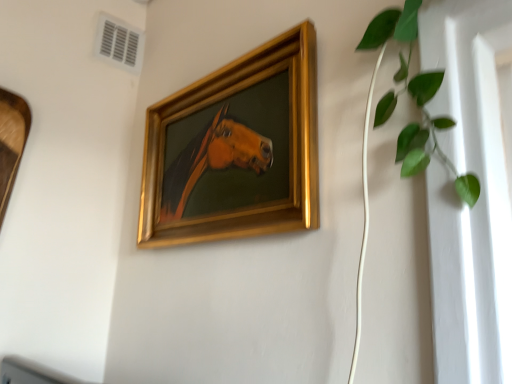
Question: Is white plastic air conditioning at upper left taller than gold/gilded picture frame at center?

Choices:
 (A) yes
 (B) no

Answer: (B)

Question: From the image's perspective, is white plastic air conditioning at upper left over gold/gilded picture frame at center?

Choices:
 (A) yes
 (B) no

Answer: (A)

Question: Considering the relative sizes of white plastic air conditioning at upper left and gold/gilded picture frame at center in the image provided, is white plastic air conditioning at upper left wider than gold/gilded picture frame at center?

Choices:
 (A) yes
 (B) no

Answer: (B)

Question: Is white plastic air conditioning at upper left positioned far away from gold/gilded picture frame at center?

Choices:
 (A) no
 (B) yes

Answer: (A)

Question: From the image's perspective, is white plastic air conditioning at upper left located beneath gold/gilded picture frame at center?

Choices:
 (A) no
 (B) yes

Answer: (A)

Question: In terms of size, does gold/gilded picture frame at center appear bigger or smaller than green leafy plant at upper right?

Choices:
 (A) big
 (B) small

Answer: (A)

Question: Relative to green leafy plant at upper right, is gold/gilded picture frame at center in front or behind?

Choices:
 (A) behind
 (B) front

Answer: (A)

Question: Would you say gold/gilded picture frame at center is to the left or to the right of green leafy plant at upper right in the picture?

Choices:
 (A) left
 (B) right

Answer: (A)

Question: From the image's perspective, is gold/gilded picture frame at center positioned above or below green leafy plant at upper right?

Choices:
 (A) below
 (B) above

Answer: (A)

Question: Visually, is white plastic air conditioning at upper left positioned to the left or to the right of green leafy plant at upper right?

Choices:
 (A) right
 (B) left

Answer: (B)

Question: Is white plastic air conditioning at upper left taller or shorter than green leafy plant at upper right?

Choices:
 (A) tall
 (B) short

Answer: (B)

Question: From a real-world perspective, is white plastic air conditioning at upper left positioned above or below green leafy plant at upper right?

Choices:
 (A) above
 (B) below

Answer: (A)

Question: Looking at the image, does white plastic air conditioning at upper left seem bigger or smaller compared to green leafy plant at upper right?

Choices:
 (A) big
 (B) small

Answer: (B)

Question: Based on their positions, is green leafy plant at upper right located to the left or right of gold/gilded picture frame at center?

Choices:
 (A) right
 (B) left

Answer: (A)

Question: Considering the positions of green leafy plant at upper right and gold/gilded picture frame at center in the image, is green leafy plant at upper right bigger or smaller than gold/gilded picture frame at center?

Choices:
 (A) big
 (B) small

Answer: (B)